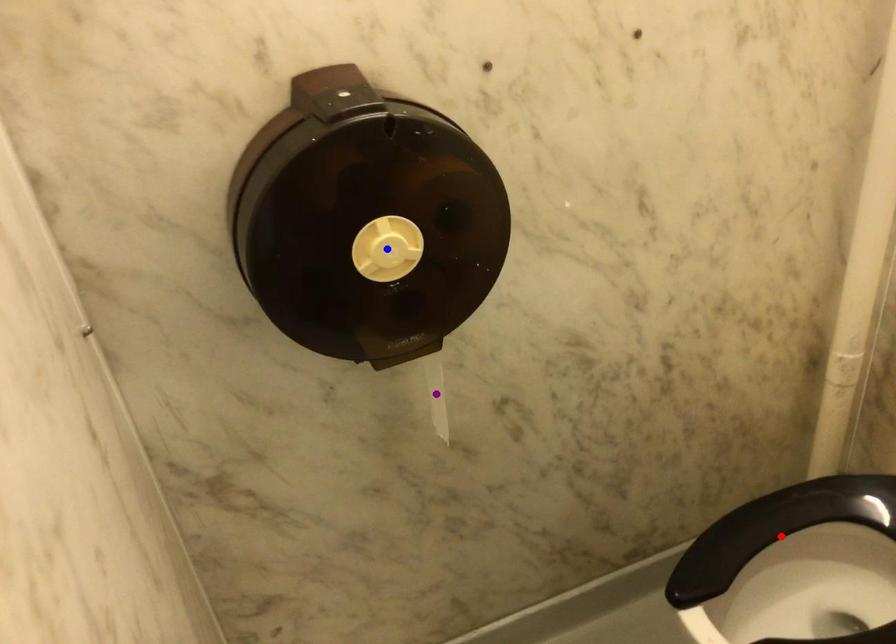
Order these from nearest to farthest:
blue point, purple point, red point

red point → purple point → blue point